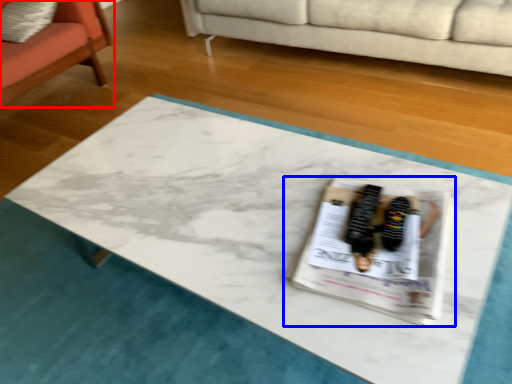
Question: Among these objects, which one is nearest to the camera, chair (highlighted by a red box) or magazine (highlighted by a blue box)?

Choices:
 (A) chair
 (B) magazine

Answer: (B)